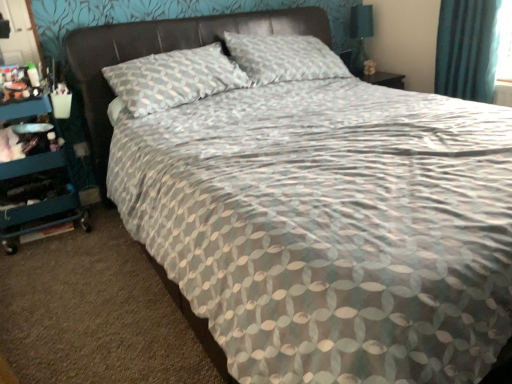
Identify the location of teal plastic dresser at left. The image size is (512, 384). (38, 178).

Describe the element at coordinates (360, 33) in the screenshot. I see `matte black table lamp at upper right` at that location.

Describe the element at coordinates (170, 44) in the screenshot. I see `leather-like headboard at upper center` at that location.

What do you see at coordinates (467, 49) in the screenshot? I see `teal fabric curtain at upper right` at bounding box center [467, 49].

Where is `teal plastic dresser at left`? The width and height of the screenshot is (512, 384). teal plastic dresser at left is located at coordinates (38, 178).

Locate an element on the screen. headboard above the teal plastic dresser at left (from the image's perspective) is located at coordinates (170, 44).

Is teal plastic dresser at left taller or shorter than leather-like headboard at upper center?

In the image, teal plastic dresser at left appears to be taller than leather-like headboard at upper center.

Which point is more distant from viewer, (56,193) or (293,34)?

Positioned behind is point (293,34).

Is matte black table lamp at upper right in front of or behind teal fabric curtain at upper right in the image?

In the image, matte black table lamp at upper right appears behind teal fabric curtain at upper right.

Would you say matte black table lamp at upper right is a long distance from teal fabric curtain at upper right?

No, matte black table lamp at upper right is in close proximity to teal fabric curtain at upper right.

Which object is positioned more to the left, matte black table lamp at upper right or teal fabric curtain at upper right?

matte black table lamp at upper right is more to the left.

From the image's perspective, is matte black table lamp at upper right above teal fabric curtain at upper right?

Yes.

Does matte black table lamp at upper right turn towards teal plastic dresser at left?

No, matte black table lamp at upper right is not facing towards teal plastic dresser at left.

Visually, is matte black table lamp at upper right positioned to the left or to the right of teal plastic dresser at left?

matte black table lamp at upper right is to the right of teal plastic dresser at left.

Does point (358, 64) lie in front of point (7, 175)?

No, (358, 64) is behind (7, 175).

Based on the photo, based on their positions, is teal plastic dresser at left located to the left or right of matte black table lamp at upper right?

In the image, teal plastic dresser at left appears on the left side of matte black table lamp at upper right.

Which is less distant, (16, 175) or (362, 25)?

Point (16, 175) is closer to the camera than point (362, 25).

From the image's perspective, is teal plastic dresser at left below matte black table lamp at upper right?

Yes.

Can you tell me how much teal plastic dresser at left and matte black table lamp at upper right differ in facing direction?

0.477 degrees.

Is matte black table lamp at upper right wider than leather-like headboard at upper center?

In fact, matte black table lamp at upper right might be narrower than leather-like headboard at upper center.

Does matte black table lamp at upper right have a larger size compared to leather-like headboard at upper center?

No, matte black table lamp at upper right is not bigger than leather-like headboard at upper center.

Is matte black table lamp at upper right in contact with leather-like headboard at upper center?

→ matte black table lamp at upper right and leather-like headboard at upper center are clearly separated.

Is leather-like headboard at upper center facing away from teal plastic dresser at left?

No, leather-like headboard at upper center's orientation is not away from teal plastic dresser at left.

From a real-world perspective, which object stands above the other?

leather-like headboard at upper center is physically above.

Which object is positioned more to the left, leather-like headboard at upper center or teal plastic dresser at left?

From the viewer's perspective, teal plastic dresser at left appears more on the left side.

Considering the sizes of leather-like headboard at upper center and teal plastic dresser at left in the image, is leather-like headboard at upper center taller or shorter than teal plastic dresser at left?

Clearly, leather-like headboard at upper center is shorter compared to teal plastic dresser at left.

Between leather-like headboard at upper center and teal fabric curtain at upper right, which one has smaller width?

teal fabric curtain at upper right.

Based on the photo, from a real-world perspective, between leather-like headboard at upper center and teal fabric curtain at upper right, who is vertically higher?

leather-like headboard at upper center, from a real-world perspective.

I want to click on curtain that is above the leather-like headboard at upper center (from the image's perspective), so click(x=467, y=49).

What's the angular difference between leather-like headboard at upper center and teal fabric curtain at upper right's facing directions?

There is a 89.4-degree angle between the facing directions of leather-like headboard at upper center and teal fabric curtain at upper right.

You are a GUI agent. You are given a task and a screenshot of the screen. Output one action in this format:
    pyautogui.click(x=<x>, y=<y>)
    Task: Click on the dresser lying below the leather-like headboard at upper center (from the image's perspective)
    This screenshot has height=384, width=512.
    Given the screenshot: What is the action you would take?
    pyautogui.click(x=38, y=178)

Identify the location of curtain that appears in front of the matte black table lamp at upper right. The image size is (512, 384). (467, 49).

From the picture: From the image, which object appears to be farther from teal plastic dresser at left, leather-like headboard at upper center or teal fabric curtain at upper right?

The object further to teal plastic dresser at left is teal fabric curtain at upper right.

Estimate the real-world distances between objects in this image. Which object is further from teal fabric curtain at upper right, teal plastic dresser at left or matte black table lamp at upper right?

teal plastic dresser at left lies further to teal fabric curtain at upper right than the other object.

When comparing their distances from matte black table lamp at upper right, does teal plastic dresser at left or teal fabric curtain at upper right seem further?

teal plastic dresser at left is positioned further to the anchor matte black table lamp at upper right.

Based on their spatial positions, is matte black table lamp at upper right or teal fabric curtain at upper right further from teal plastic dresser at left?

Among the two, matte black table lamp at upper right is located further to teal plastic dresser at left.

Considering their positions, is leather-like headboard at upper center positioned further to matte black table lamp at upper right than teal plastic dresser at left?

Based on the image, teal plastic dresser at left appears to be further to matte black table lamp at upper right.

From the image, which object appears to be farther from leather-like headboard at upper center, teal fabric curtain at upper right or teal plastic dresser at left?

teal fabric curtain at upper right is positioned further to the anchor leather-like headboard at upper center.

When comparing their distances from matte black table lamp at upper right, does leather-like headboard at upper center or teal fabric curtain at upper right seem further?

leather-like headboard at upper center.

Which object lies nearer to the anchor point matte black table lamp at upper right, teal plastic dresser at left or leather-like headboard at upper center?

Based on the image, leather-like headboard at upper center appears to be nearer to matte black table lamp at upper right.

The image size is (512, 384). Find the location of `headboard situated between teal plastic dresser at left and teal fabric curtain at upper right from left to right`. headboard situated between teal plastic dresser at left and teal fabric curtain at upper right from left to right is located at coordinates (170, 44).

At what (x,y) coordinates should I click in order to perform the action: click on table lamp located between leather-like headboard at upper center and teal fabric curtain at upper right in the left-right direction. Please return your answer as a coordinate pair (x, y). This screenshot has width=512, height=384. Looking at the image, I should click on (360, 33).

Where is `headboard located between teal plastic dresser at left and matte black table lamp at upper right in the left-right direction`? The image size is (512, 384). headboard located between teal plastic dresser at left and matte black table lamp at upper right in the left-right direction is located at coordinates 170,44.

Find the location of a particular element. This screenshot has width=512, height=384. table lamp between teal plastic dresser at left and teal fabric curtain at upper right from left to right is located at coordinates (360, 33).